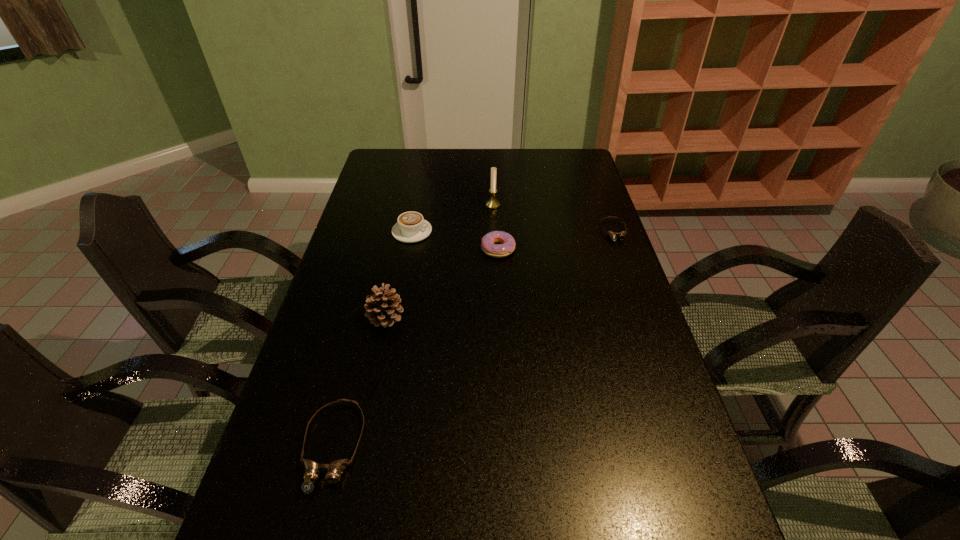
Locate an element on the screen. Image resolution: width=960 pixels, height=540 pixels. vacant space that satisfies the following two spatial constraints: 1. with the handle on the right side of the fourth shortest object; 2. on the front lenses and sides of the nearer goggles is located at coordinates (372, 447).

I want to click on vacant region that satisfies the following two spatial constraints: 1. on the back side of the pinecone; 2. on the right side of the doughnut, so click(x=400, y=249).

This screenshot has height=540, width=960. I want to click on free space that satisfies the following two spatial constraints: 1. with the handle on the right side of the cappuccino; 2. on the front lenses and sides of the left goggles, so [x=372, y=447].